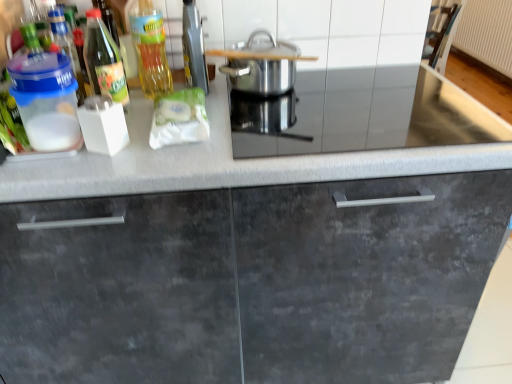
Question: Considering the relative sizes of stainless steel pot at center and metallic silver toaster at upper center in the image provided, is stainless steel pot at center smaller than metallic silver toaster at upper center?

Choices:
 (A) yes
 (B) no

Answer: (B)

Question: From the image's perspective, is stainless steel pot at center under metallic silver toaster at upper center?

Choices:
 (A) yes
 (B) no

Answer: (A)

Question: Can you confirm if stainless steel pot at center is wider than metallic silver toaster at upper center?

Choices:
 (A) no
 (B) yes

Answer: (B)

Question: Is stainless steel pot at center facing towards metallic silver toaster at upper center?

Choices:
 (A) yes
 (B) no

Answer: (B)

Question: Is the depth of stainless steel pot at center less than that of metallic silver toaster at upper center?

Choices:
 (A) no
 (B) yes

Answer: (A)

Question: Is transparent plastic container at left, which ranks as the third bottle in right-to-left order, wider or thinner than white textured radiator at upper right?

Choices:
 (A) thin
 (B) wide

Answer: (A)

Question: Based on their positions, is transparent plastic container at left, which ranks as the third bottle in right-to-left order, located to the left or right of white textured radiator at upper right?

Choices:
 (A) right
 (B) left

Answer: (B)

Question: From a real-world perspective, is transparent plastic container at left, the 1th bottle viewed from the left, physically located above or below white textured radiator at upper right?

Choices:
 (A) above
 (B) below

Answer: (A)

Question: Is transparent plastic container at left, the 1th bottle viewed from the left, bigger or smaller than white textured radiator at upper right?

Choices:
 (A) small
 (B) big

Answer: (A)

Question: Would you say matte gray cabinet at center is to the left or to the right of translucent plastic container at upper left in the picture?

Choices:
 (A) left
 (B) right

Answer: (B)

Question: Does point (265, 289) appear closer or farther from the camera than point (58, 132)?

Choices:
 (A) closer
 (B) farther

Answer: (B)

Question: Which is correct: matte gray cabinet at center is inside translucent plastic container at upper left, or outside of it?

Choices:
 (A) inside
 (B) outside

Answer: (B)

Question: From a real-world perspective, is matte gray cabinet at center positioned above or below translucent plastic container at upper left?

Choices:
 (A) above
 (B) below

Answer: (B)

Question: Is point (203, 54) positioned closer to the camera than point (352, 375)?

Choices:
 (A) farther
 (B) closer

Answer: (B)

Question: Considering the positions of metallic silver toaster at upper center and matte gray cabinet at center in the image, is metallic silver toaster at upper center wider or thinner than matte gray cabinet at center?

Choices:
 (A) thin
 (B) wide

Answer: (A)